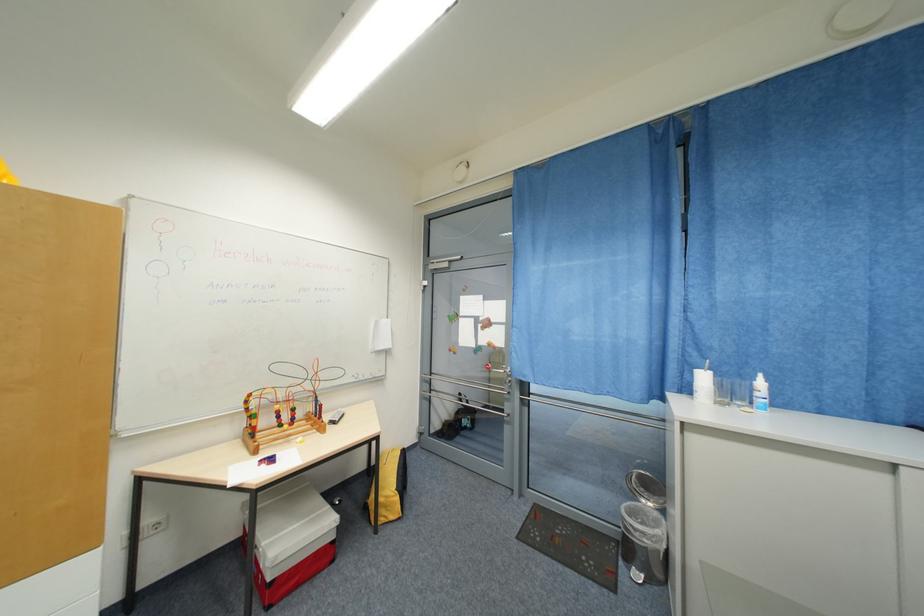
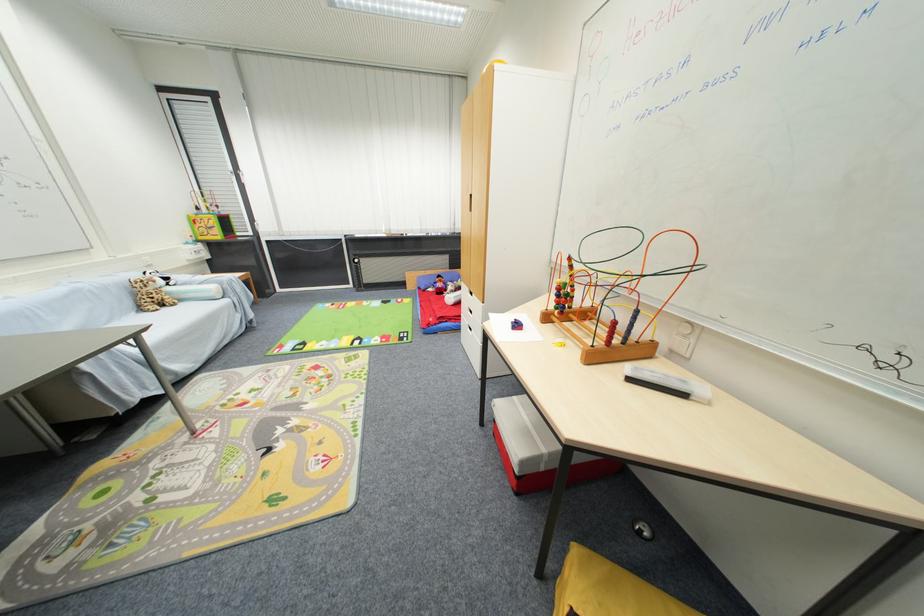
Where in the second image is the point corresponding to point 254,397 from the first image?

(575, 261)